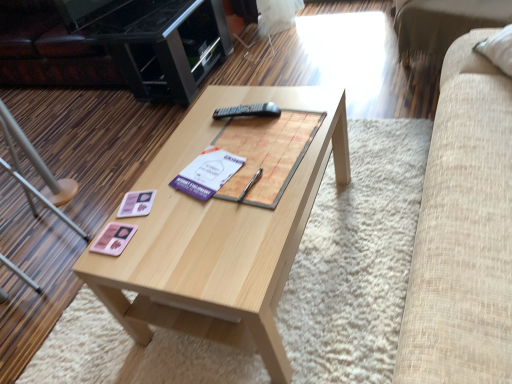
The height and width of the screenshot is (384, 512). Find the location of `free location to the left of black plastic remote at center`. free location to the left of black plastic remote at center is located at coordinates click(198, 134).